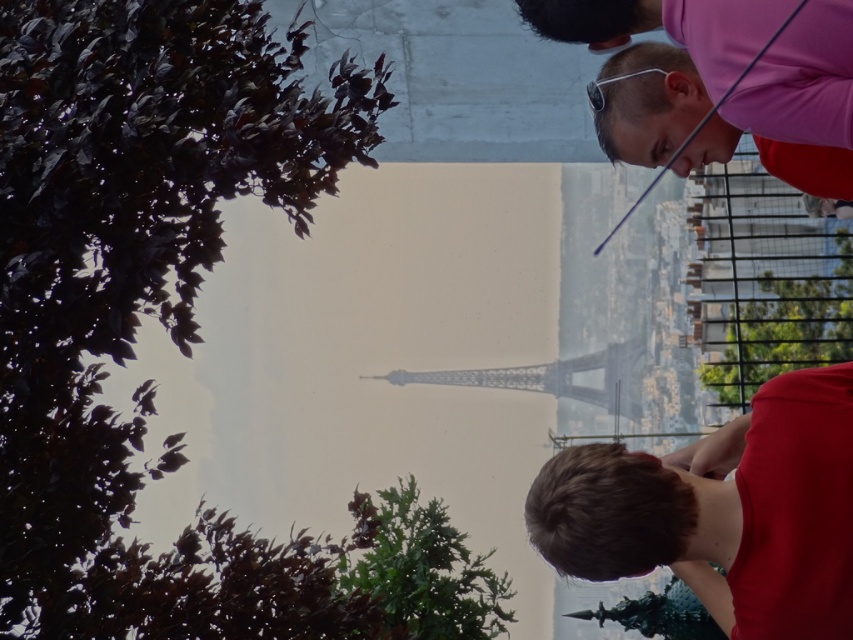
Question: Where is brown hair at lower right located in relation to metallic gray eiffel tower at center in the image?

Choices:
 (A) above
 (B) below

Answer: (B)

Question: Which point appears farthest from the camera in this image?

Choices:
 (A) (845, 506)
 (B) (665, 92)

Answer: (B)

Question: Is brown hair at lower right wider than metallic gray eiffel tower at center?

Choices:
 (A) no
 (B) yes

Answer: (B)

Question: Which point is farther to the camera?

Choices:
 (A) (564, 365)
 (B) (842, 616)

Answer: (A)

Question: Can you confirm if pink fabric at upper right is positioned above metallic gray eiffel tower at center?

Choices:
 (A) no
 (B) yes

Answer: (B)

Question: Which of these objects is positioned closest to the metallic gray eiffel tower at center?

Choices:
 (A) pink fabric at upper right
 (B) brown hair at lower right

Answer: (A)